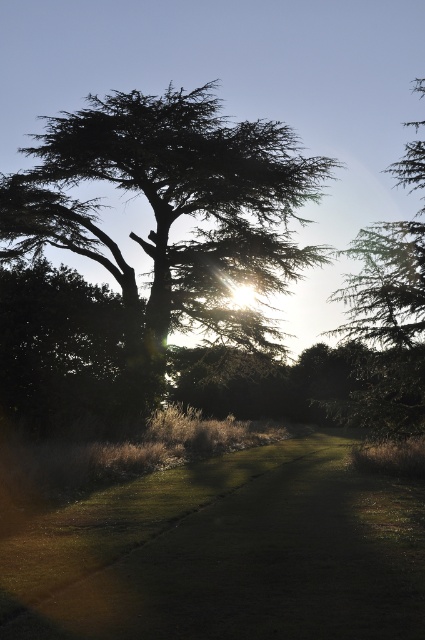
You are standing on the grassy path in the foreground and want to walk towards the green leafy tree at center. Which direction should you go to avoid the taller green textured tree at upper right?

To avoid the taller green textured tree at upper right, you should walk towards the green leafy tree at center since it is shorter than the green textured tree at upper right.

You are standing at the edge of the green grass at center and want to take a photo of the green leafy tree at center. Which object should be closer to the camera to ensure the tree is in focus?

The green grass at center is not as tall as the green leafy tree at center, so the tree is farther away. To ensure the tree is in focus, the camera should be positioned closer to the green grass at center.

You are standing at the point closer to the camera in the scene. Which point are you at, point (x=232, y=452) or point (x=201, y=168)?

You are at point (x=201, y=168) because it is closer to the camera than point (x=232, y=452).